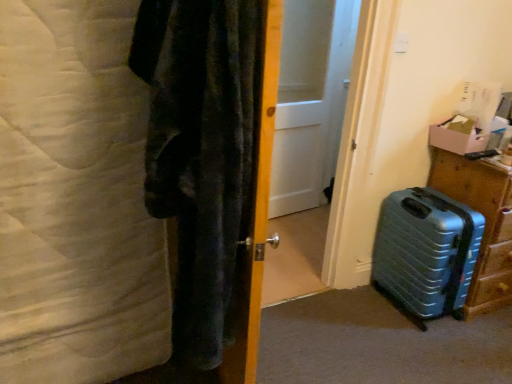
You are a GUI agent. You are given a task and a screenshot of the screen. Output one action in this format:
    pyautogui.click(x=<x>, y=<y>)
    Task: Click on the free space in front of metallic blue suitcase at lower right
    
    Given the screenshot: What is the action you would take?
    pyautogui.click(x=437, y=350)